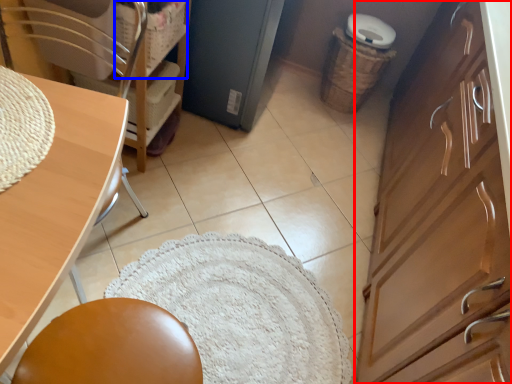
Question: Which object is further to the camera taking this photo, cabinetry (highlighted by a red box) or basket (highlighted by a blue box)?

Choices:
 (A) cabinetry
 (B) basket

Answer: (B)